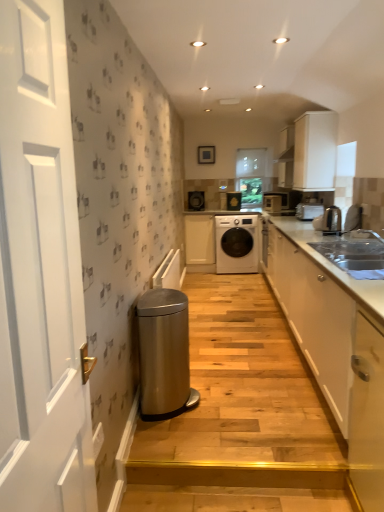
This screenshot has width=384, height=512. I want to click on vacant area that lies to the right of satin silver water heater at lower left, so click(x=230, y=412).